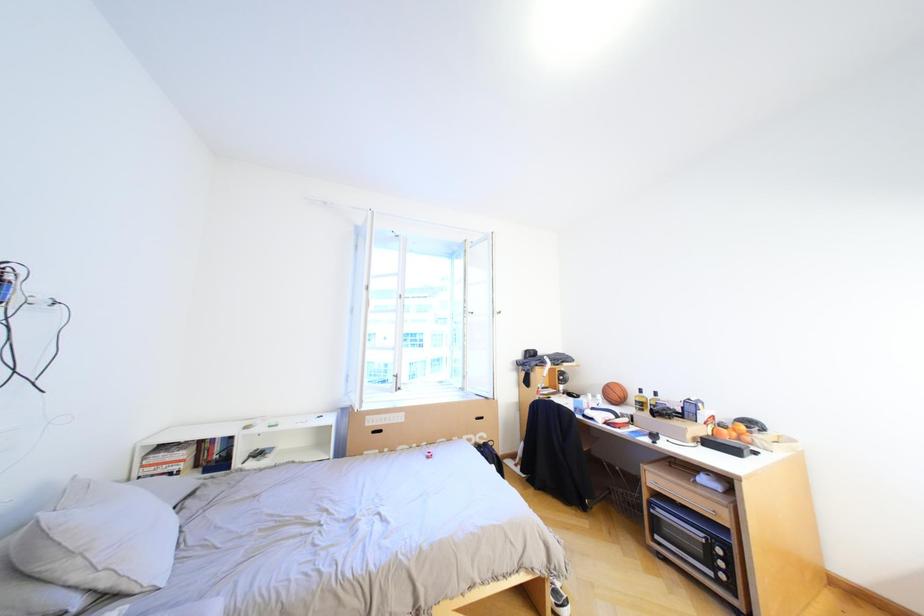
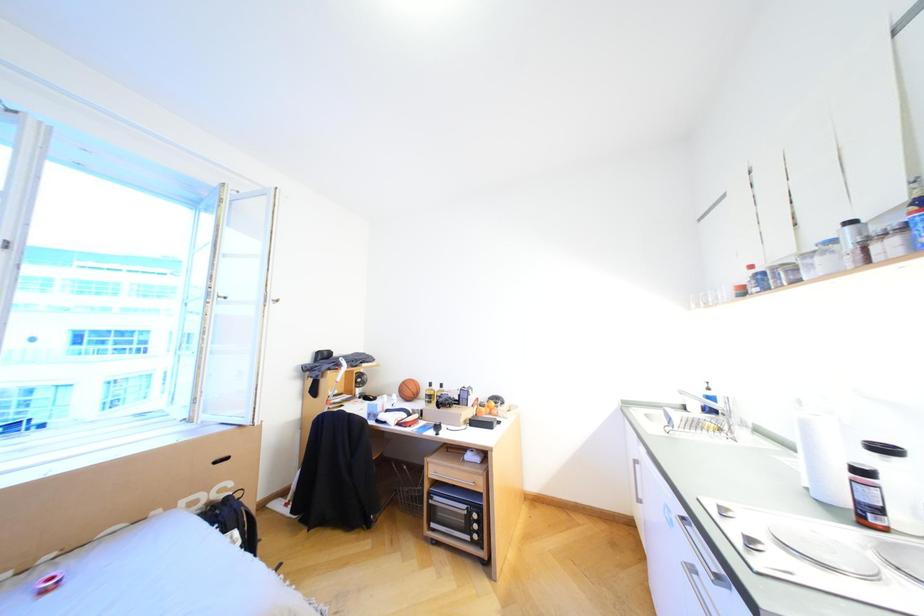
Question: The camera is either moving clockwise (left) or counter-clockwise (right) around the object. The first image is from the beginning of the video and the second image is from the end. Is the camera moving left or right when shooting the video?

Choices:
 (A) Left
 (B) Right

Answer: (A)